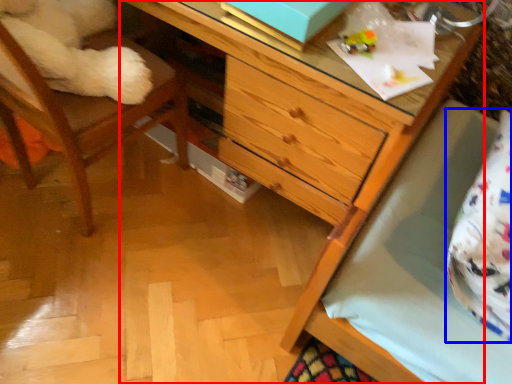
Question: Which object appears farthest to the camera in this image, chest of drawers (highlighted by a red box) or pillow (highlighted by a blue box)?

Choices:
 (A) chest of drawers
 (B) pillow

Answer: (A)